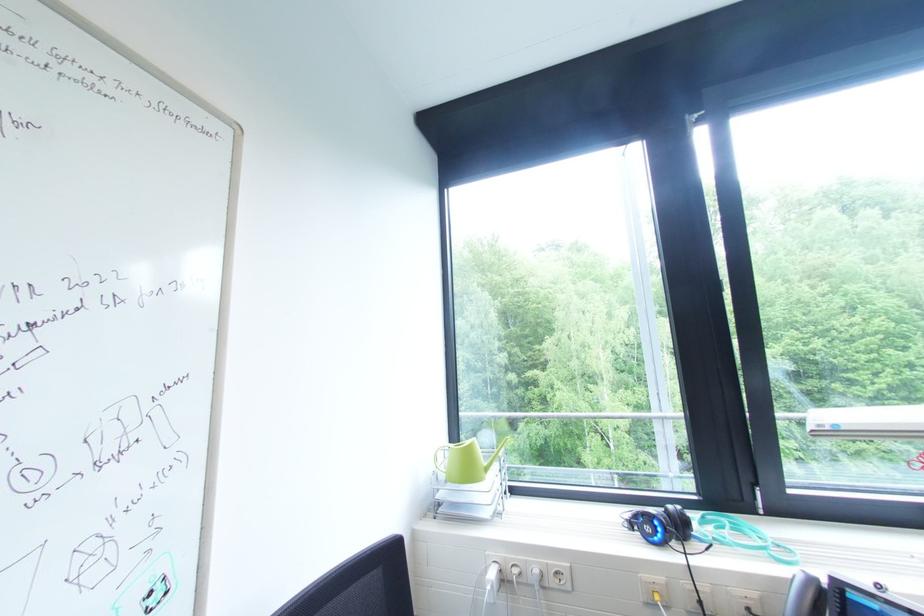
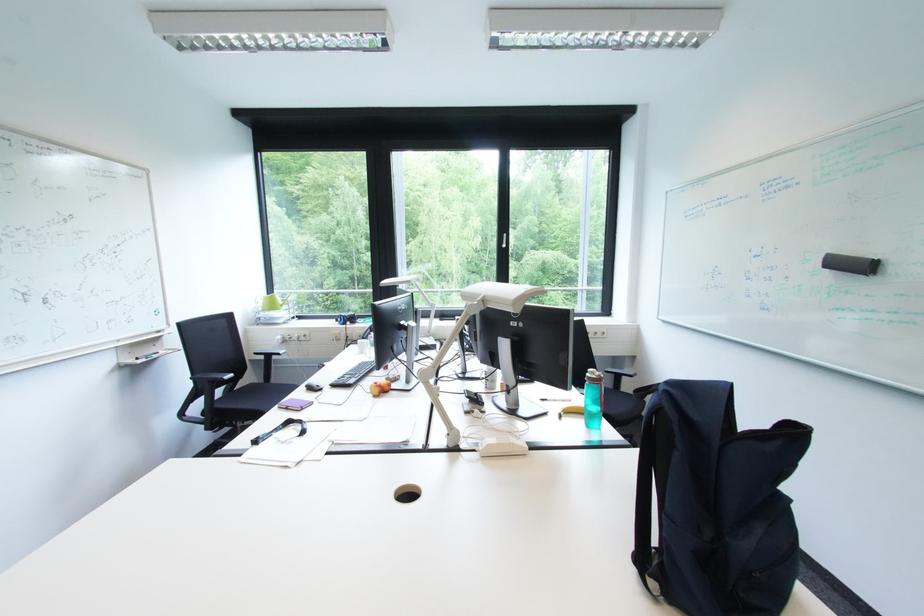
The point at (x=453, y=479) is marked in the first image. Where is the corresponding point in the second image?

(270, 310)